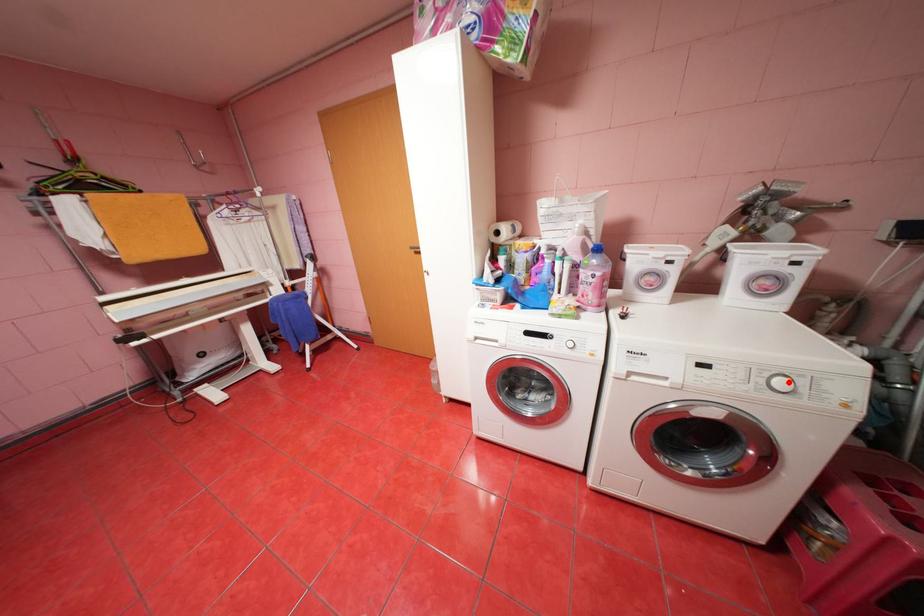
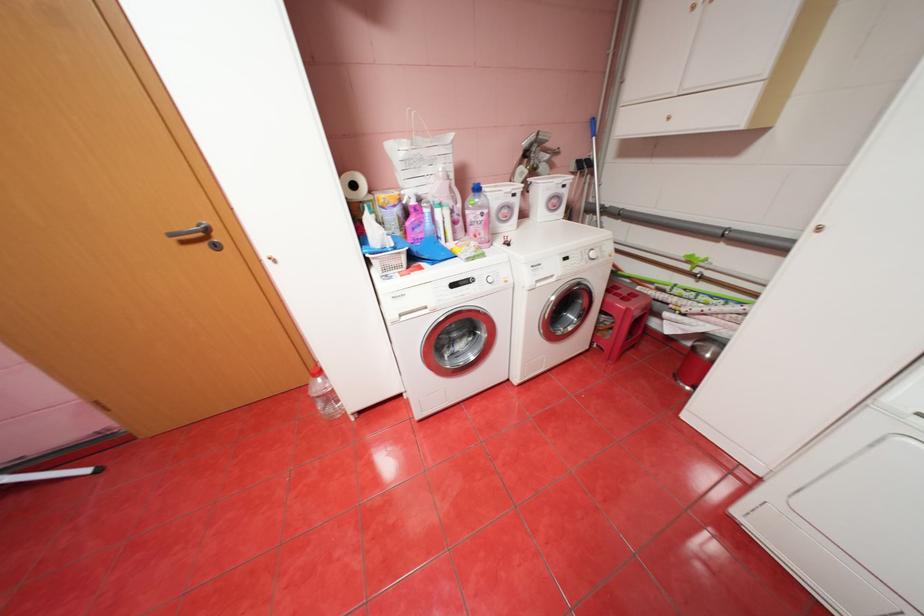
The point at the highlighted location is marked in the first image. Where is the corresponding point in the second image?

(602, 254)